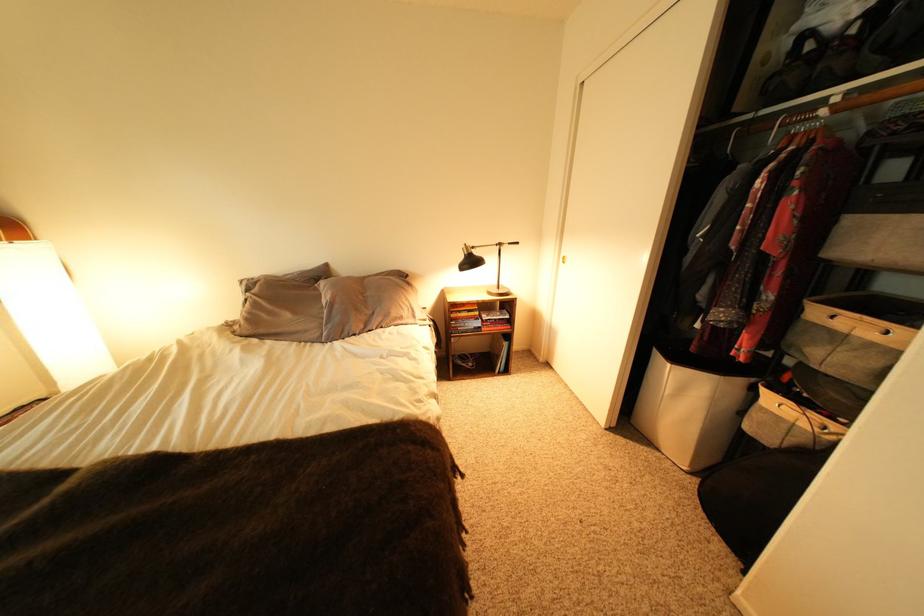
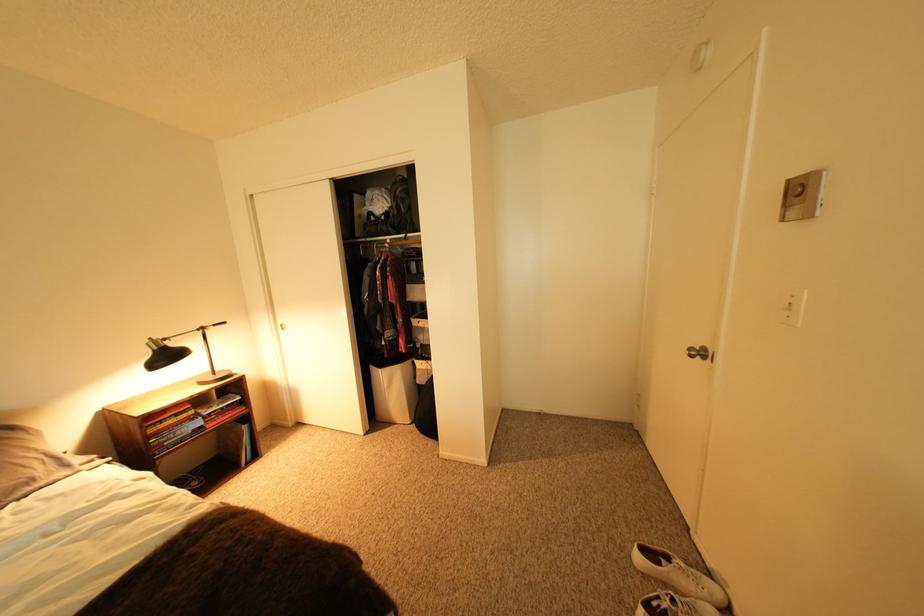
Find the pixel in the second image that matches point 477,326 in the first image.

(188, 435)